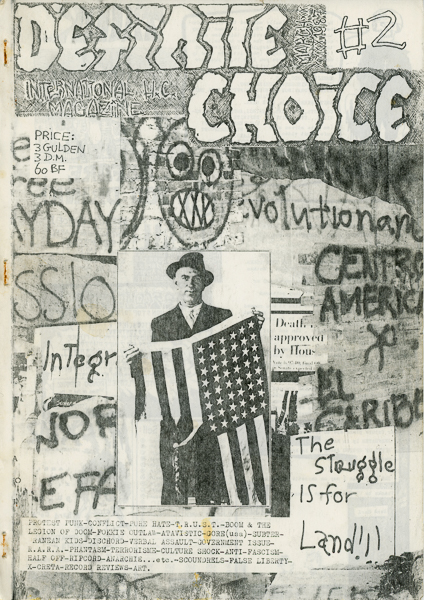
Identify the location of white sheet. (363, 509).